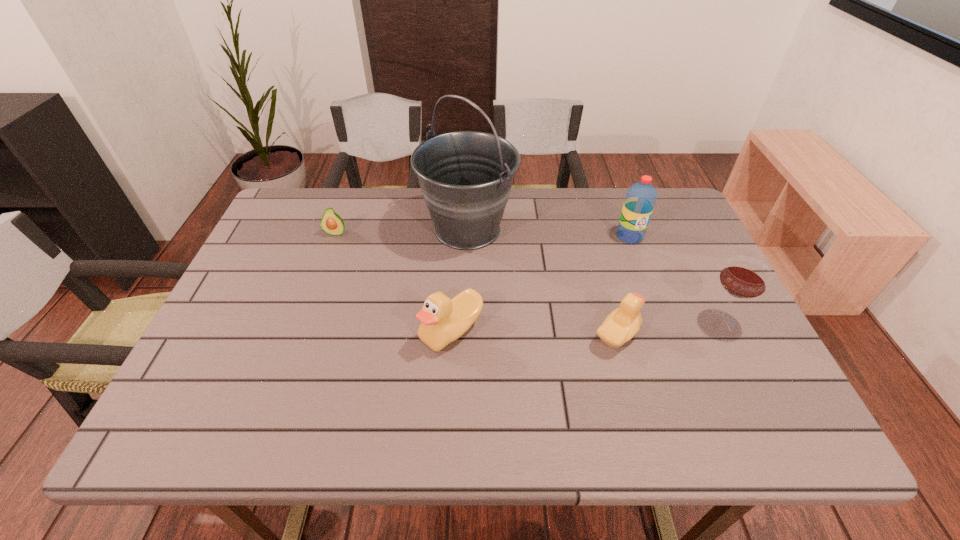
Please point a free position for a duck on the left. Please provide its 2D coordinates. Your answer should be formatted as a tuple, i.e. [(x, y)], where the tuple contains the x and y coordinates of a point satisfying the conditions above.

[(289, 326)]